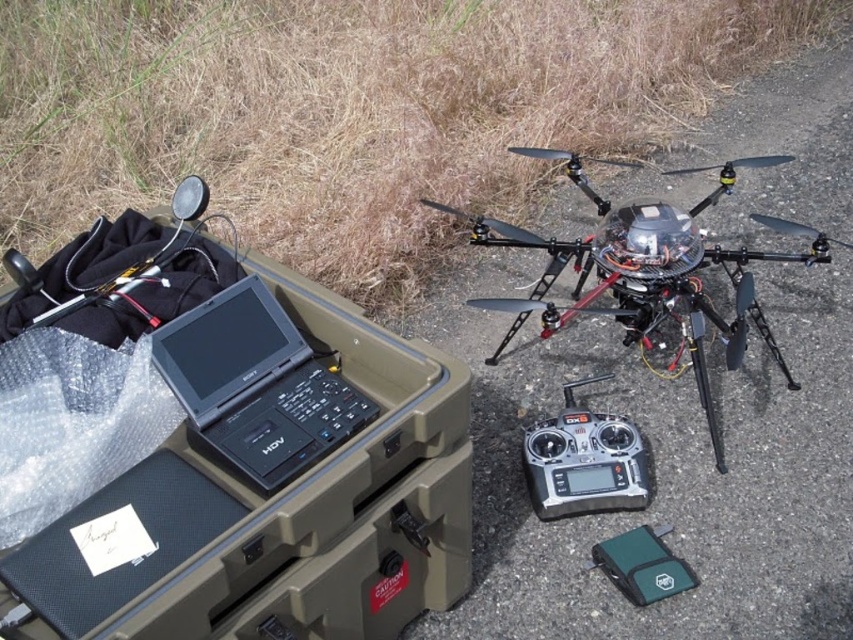
Question: Which object is farther from the camera taking this photo?

Choices:
 (A) black plastic remote control at center
 (B) metallic black drone at center-right
 (C) black matte laptop at center

Answer: (A)

Question: Does metallic black drone at center-right appear over black matte laptop at center?

Choices:
 (A) no
 (B) yes

Answer: (B)

Question: Does metallic black drone at center-right have a greater width compared to black plastic remote control at center?

Choices:
 (A) no
 (B) yes

Answer: (B)

Question: Considering the real-world distances, which object is closest to the black matte laptop at center?

Choices:
 (A) metallic black drone at center-right
 (B) black plastic remote control at center

Answer: (B)

Question: Based on their relative distances, which object is nearer to the metallic black drone at center-right?

Choices:
 (A) black matte laptop at center
 (B) black plastic remote control at center

Answer: (B)

Question: Does metallic black drone at center-right have a greater width compared to black plastic remote control at center?

Choices:
 (A) no
 (B) yes

Answer: (B)